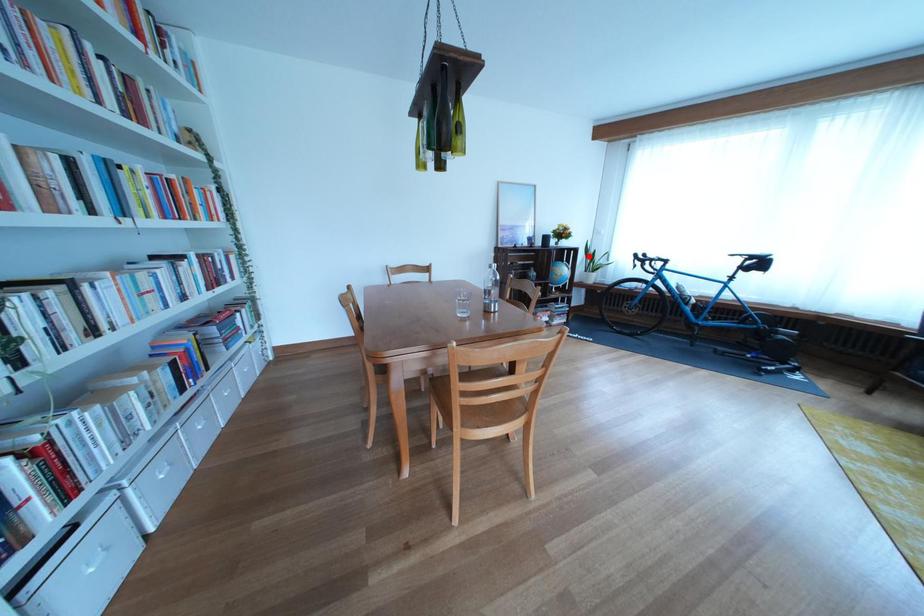
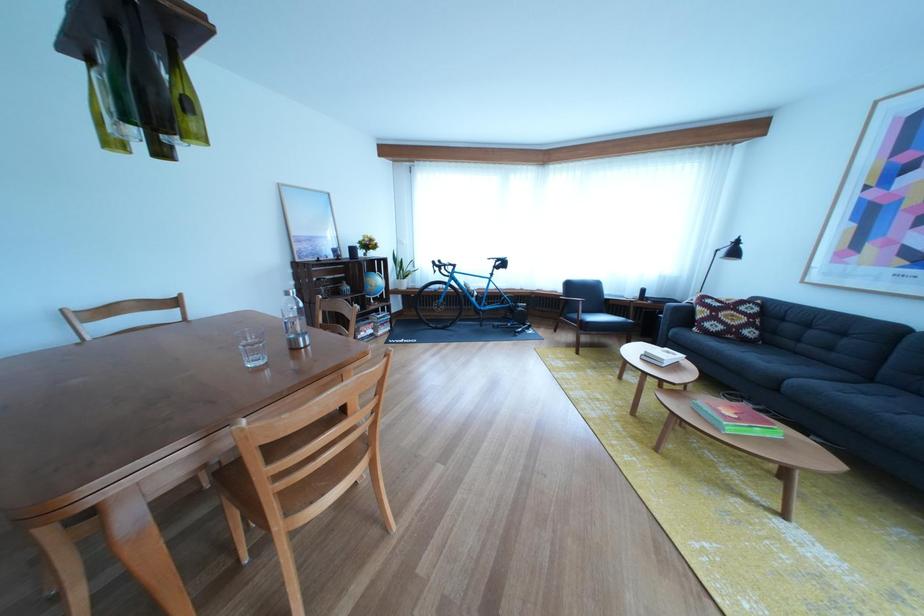
Find the pixel in the second image that matches the highlighted location in the first image.

(398, 265)